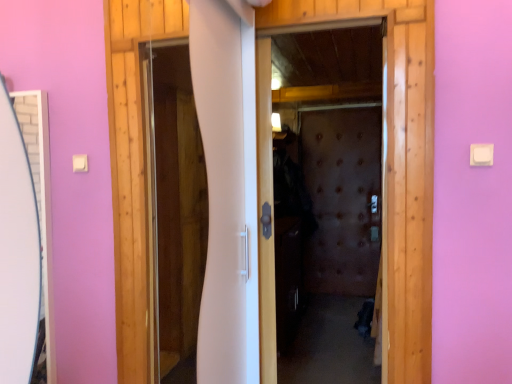
Question: Is point (185, 337) closer or farther from the camera than point (364, 195)?

Choices:
 (A) farther
 (B) closer

Answer: (B)

Question: Do you think white glossy screen door at center, the first screen door viewed from the front, is within brown textured screen door at center, placed as the first screen door when sorted from back to front, or outside of it?

Choices:
 (A) inside
 (B) outside

Answer: (B)

Question: From the image's perspective, is white glossy screen door at center, placed as the second screen door when sorted from back to front, positioned above or below brown textured screen door at center, the 2th screen door from the left?

Choices:
 (A) above
 (B) below

Answer: (A)

Question: Do you think brown textured screen door at center, placed as the second screen door when sorted from front to back, is within white glossy screen door at center, the first screen door viewed from the front, or outside of it?

Choices:
 (A) outside
 (B) inside

Answer: (A)

Question: Based on their positions, is brown textured screen door at center, placed as the second screen door when sorted from front to back, located to the left or right of white glossy screen door at center, the 2th screen door from the right?

Choices:
 (A) left
 (B) right

Answer: (B)

Question: Considering the positions of brown textured screen door at center, placed as the first screen door when sorted from back to front, and white glossy screen door at center, placed as the second screen door when sorted from back to front, in the image, is brown textured screen door at center, placed as the first screen door when sorted from back to front, wider or thinner than white glossy screen door at center, placed as the second screen door when sorted from back to front,?

Choices:
 (A) thin
 (B) wide

Answer: (B)

Question: From a real-world perspective, is brown textured screen door at center, the 2th screen door from the left, above or below white glossy screen door at center, placed as the second screen door when sorted from back to front?

Choices:
 (A) below
 (B) above

Answer: (A)